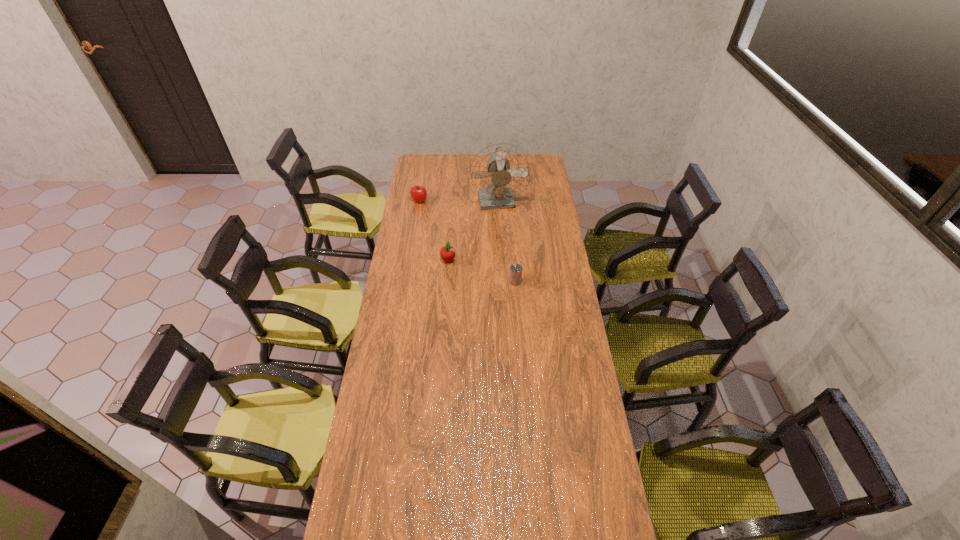
Where is `object positioned at the left edge`? object positioned at the left edge is located at coordinates [x=418, y=193].

Image resolution: width=960 pixels, height=540 pixels. In order to click on object positioned at the right edge in this screenshot , I will do click(x=499, y=172).

Find the location of a particular element. This screenshot has width=960, height=540. vacant point at the left edge is located at coordinates (408, 270).

In order to click on vacant region at the right edge of the desktop in this screenshot , I will do `click(566, 431)`.

Find the location of `free space at the far left corner`. free space at the far left corner is located at coordinates (421, 156).

At what (x,y) coordinates should I click in order to perform the action: click on unoccupied area between the right apple and the fan. Please return your answer as a coordinate pair (x, y). Looking at the image, I should click on (473, 232).

Locate an element on the screen. vacant area between the tallest object and the farther apple is located at coordinates (459, 202).

At what (x,y) coordinates should I click in order to perform the action: click on vacant area that lies between the right apple and the tallest object. Please return your answer as a coordinate pair (x, y). Image resolution: width=960 pixels, height=540 pixels. Looking at the image, I should click on (473, 232).

Image resolution: width=960 pixels, height=540 pixels. What are the coordinates of `vacant region between the farther apple and the nearer apple` in the screenshot? It's located at (434, 231).

At what (x,y) coordinates should I click in order to perform the action: click on empty space that is in between the farther apple and the fan. Please return your answer as a coordinate pair (x, y). This screenshot has height=540, width=960. Looking at the image, I should click on (459, 202).